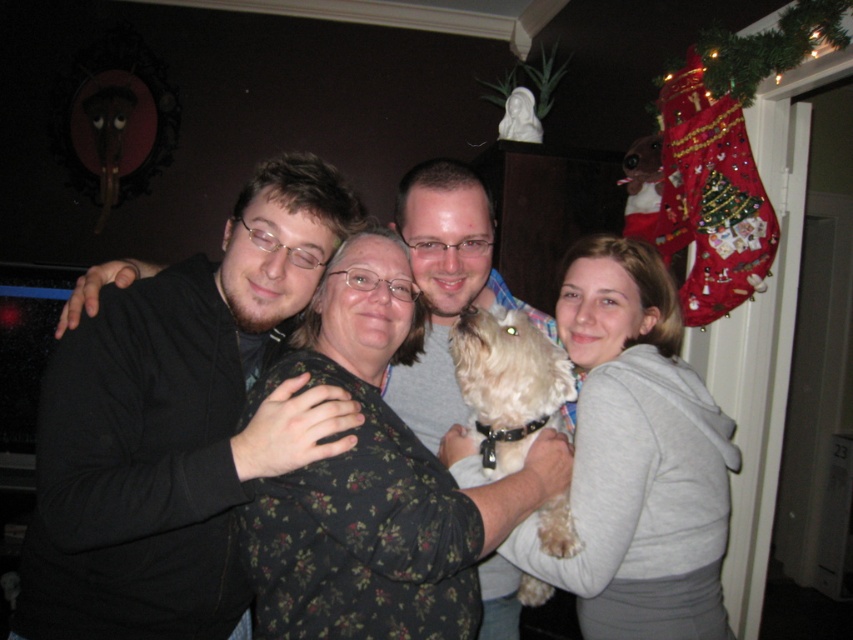
Can you confirm if black matte jacket at left is positioned to the right of fluffy white dog at center?

Incorrect, black matte jacket at left is not on the right side of fluffy white dog at center.

Is point (45, 524) positioned in front of point (463, 300)?

Yes.

Who is more forward, (236, 486) or (428, 193)?

Point (236, 486) is in front.

Locate an element on the screen. The height and width of the screenshot is (640, 853). black matte jacket at left is located at coordinates pyautogui.click(x=178, y=424).

Measure the distance from gray fleece at right to white fluffy dog at center.

gray fleece at right and white fluffy dog at center are 5.07 inches apart from each other.

Is gray fleece at right behind white fluffy dog at center?

No, gray fleece at right is closer to the viewer.

Which is behind, point (688, 394) or point (521, 595)?

The point (521, 595) is behind.

Locate an element on the screen. This screenshot has width=853, height=640. gray fleece at right is located at coordinates tap(637, 458).

Measure the distance between point (x=280, y=608) and camera.

Point (x=280, y=608) and camera are 3.54 feet apart.

Is floral print shirt at center wider than fluffy white dog at center?

Yes.

Between point (479, 518) and point (402, 369), which one is positioned behind?

Positioned behind is point (402, 369).

Identify the location of floral print shirt at center. The width and height of the screenshot is (853, 640). (375, 481).